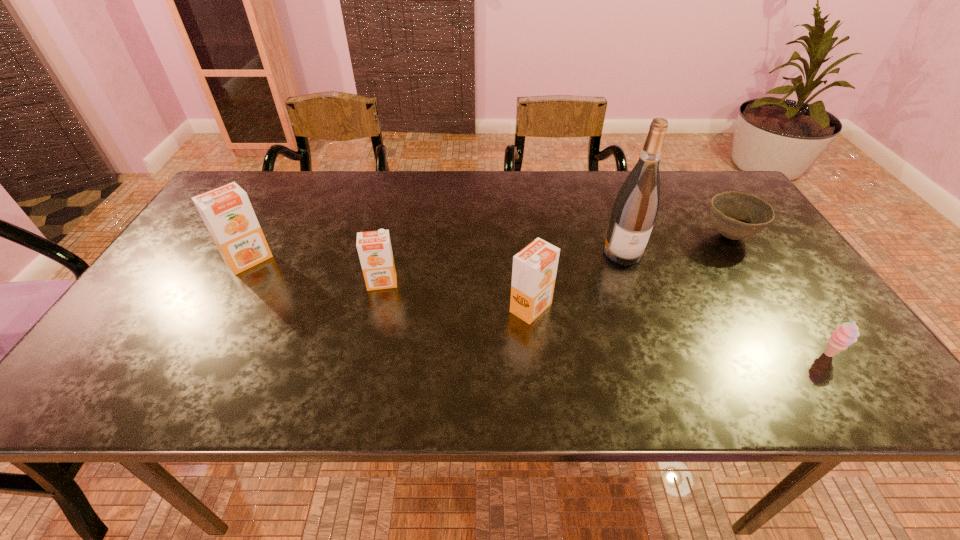
In order to click on the leftmost orange juice in this screenshot , I will do `click(227, 212)`.

Where is `the shortest orange juice`? The width and height of the screenshot is (960, 540). the shortest orange juice is located at coordinates (374, 248).

Locate an element on the screen. the fifth object from right to left is located at coordinates (374, 248).

Identify the location of the nearest orange juice. (534, 270).

The image size is (960, 540). What are the coordinates of `the third object from left to right` in the screenshot? It's located at (534, 270).

The image size is (960, 540). I want to click on bowl, so click(736, 215).

Identify the location of wine bottle. This screenshot has width=960, height=540. (636, 206).

Locate an element on the screen. the tallest object is located at coordinates (636, 206).

Locate an element on the screen. the nearest object is located at coordinates (844, 335).

You are a GUI agent. You are given a task and a screenshot of the screen. Output one action in this format:
    pyautogui.click(x=<x>, y=<y>)
    Task: Click on the free space located on the right of the leftmost object
    Image resolution: width=960 pixels, height=540 pixels.
    Given the screenshot: What is the action you would take?
    pyautogui.click(x=299, y=260)